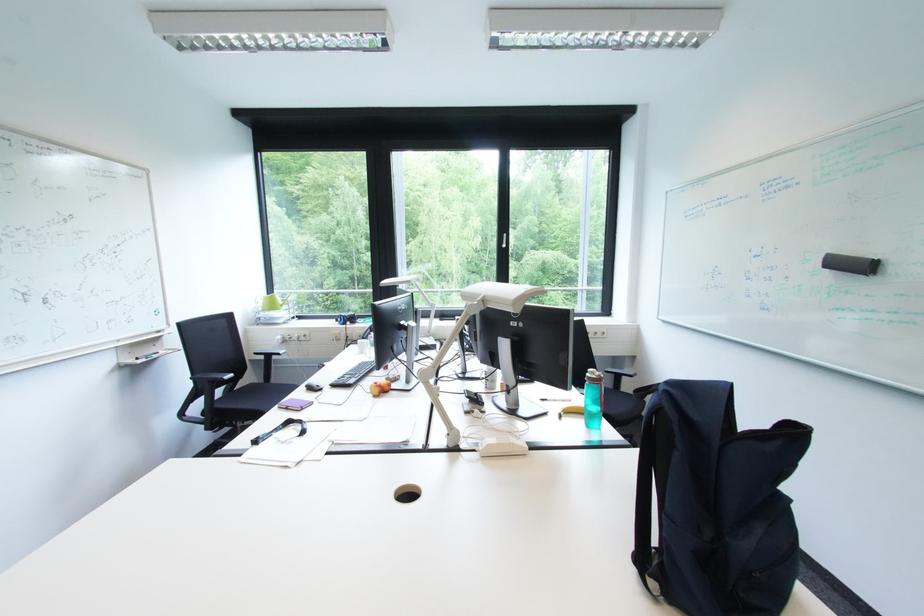
Identify the location of black backpack handle. This screenshot has height=616, width=924. (651, 493).